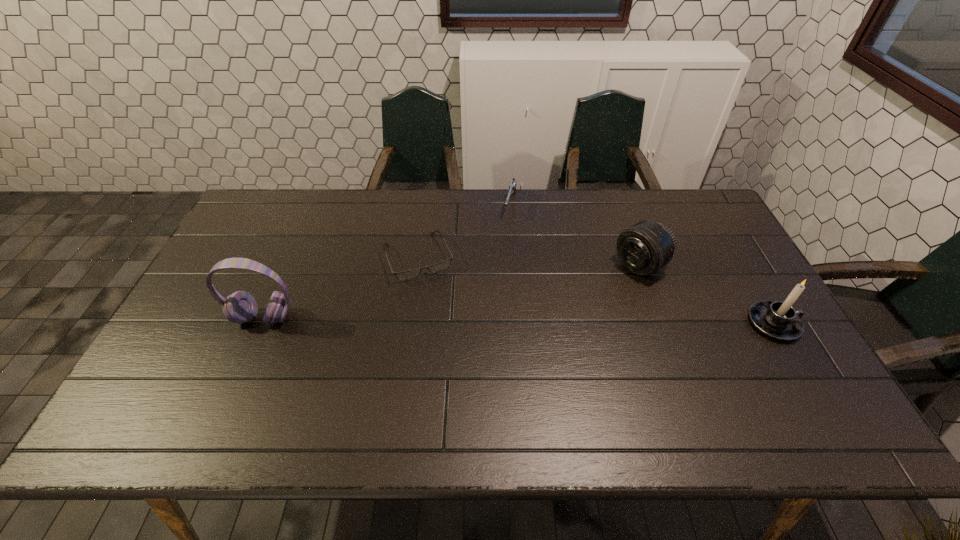
The height and width of the screenshot is (540, 960). I want to click on object positioned at the left edge, so click(240, 307).

This screenshot has height=540, width=960. I want to click on object that is at the right edge, so click(x=779, y=320).

Locate an element on the screen. This screenshot has height=540, width=960. blank space at the far edge is located at coordinates (353, 195).

Find the location of a particular element. The width and height of the screenshot is (960, 540). vacant position at the near edge of the desktop is located at coordinates (332, 377).

At what (x,y) coordinates should I click in order to perform the action: click on free point at the far left corner. Please return your answer as a coordinate pair (x, y). Looking at the image, I should click on (285, 228).

In the image, there is a desktop. At what (x,y) coordinates should I click in order to perform the action: click on vacant space at the near right corner. Please return your answer as a coordinate pair (x, y). This screenshot has height=540, width=960. Looking at the image, I should click on (750, 387).

Where is `vacant area that lies between the tallest object and the second object from left to right`? vacant area that lies between the tallest object and the second object from left to right is located at coordinates (342, 288).

This screenshot has height=540, width=960. In order to click on empty location between the candle holder and the spectacles in this screenshot , I will do `click(596, 291)`.

Locate an element on the screen. This screenshot has height=540, width=960. free space between the spectacles and the farthest object is located at coordinates (465, 231).

You are a GUI agent. You are given a task and a screenshot of the screen. Output one action in this format:
    pyautogui.click(x=<x>, y=<y>)
    Task: Click on the empty space that is in between the headset and the fourth object from left to right
    
    Given the screenshot: What is the action you would take?
    pyautogui.click(x=452, y=292)